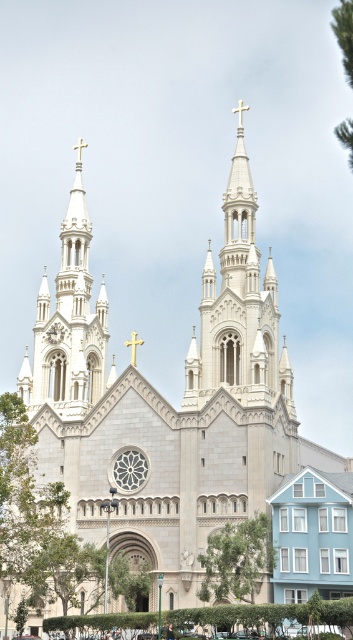
Question: Which is nearer to the green leafy tree at upper right?

Choices:
 (A) green leafy tree at lower left
 (B) green leafy tree at center

Answer: (A)

Question: Observing the image, what is the correct spatial positioning of green leafy tree at lower left in reference to green leafy tree at center?

Choices:
 (A) below
 (B) above

Answer: (B)

Question: Which point is farther from the camera taking this photo?

Choices:
 (A) (338, 8)
 (B) (220, 541)

Answer: (B)

Question: Is green leafy tree at lower left positioned before green leafy tree at upper right?

Choices:
 (A) no
 (B) yes

Answer: (A)

Question: Does green leafy tree at lower left have a greater width compared to green leafy tree at center?

Choices:
 (A) yes
 (B) no

Answer: (A)

Question: Among these points, which one is nearest to the camera?

Choices:
 (A) (24, 476)
 (B) (244, 588)
 (C) (333, 12)

Answer: (C)